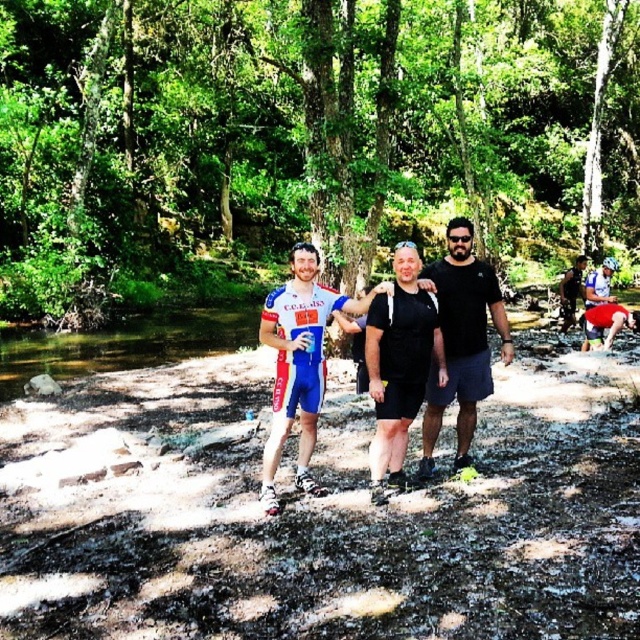
You are a photographer trying to capture a clear shot of both the black matte shorts at center and the blue fabric shorts at center. Since they are positioned close to each other, will adjusting the camera focus allow you to clearly see both subjects at the same time?

The black matte shorts at center is in front of blue fabric shorts at center, so adjusting the camera focus might make one clearer while the other becomes blurry. To capture both clearly, you might need to adjust their positions or use a different camera setting.

You are a photographer trying to capture a photo of the green leafy forest at center and the blue fabric shorts at center. Which object would appear larger in the photo?

The green leafy forest at center appears larger in the photo because it is bigger than the blue fabric shorts at center.